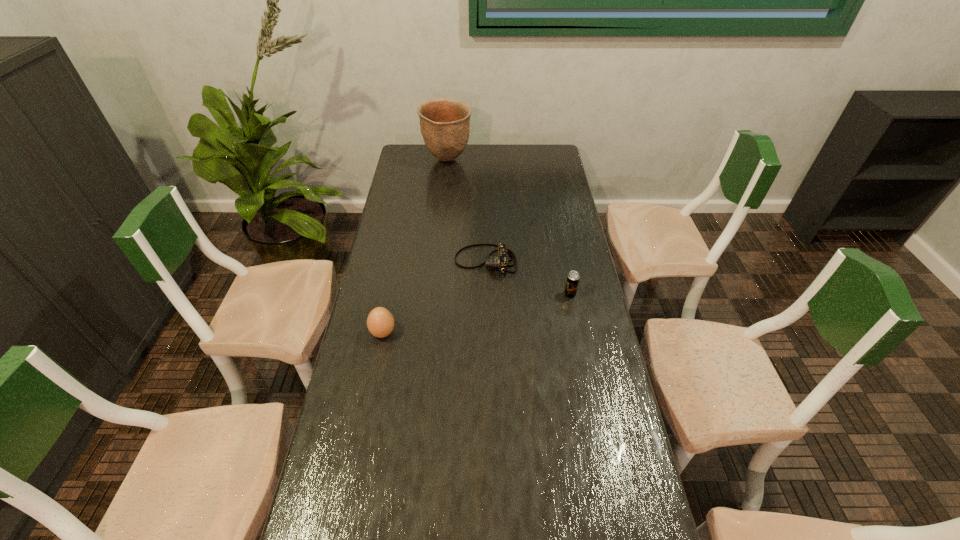
This screenshot has height=540, width=960. Find the location of `vacant space located 0.190m on the front-facing side of the camera`. vacant space located 0.190m on the front-facing side of the camera is located at coordinates (404, 262).

At what (x,y) coordinates should I click in order to perform the action: click on vacant area situated 0.150m on the front-facing side of the camera. Please return your answer as a coordinate pair (x, y). The height and width of the screenshot is (540, 960). Looking at the image, I should click on (415, 262).

Locate an element on the screen. This screenshot has width=960, height=540. free location located 0.270m on the front-facing side of the camera is located at coordinates (383, 262).

What are the coordinates of `object situated at the far edge` in the screenshot? It's located at (445, 123).

Where is `pottery that is positioned at the left edge`? pottery that is positioned at the left edge is located at coordinates (445, 123).

Locate an element on the screen. This screenshot has width=960, height=540. boiled egg at the left edge is located at coordinates (380, 322).

Locate an element on the screen. object present at the right edge is located at coordinates pyautogui.click(x=573, y=277).

This screenshot has width=960, height=540. What are the coordinates of `object at the far left corner` in the screenshot? It's located at (445, 123).

The height and width of the screenshot is (540, 960). Identify the location of vacant area at the far edge of the desktop. (498, 168).

What are the coordinates of `vacant region at the left edge of the desktop` in the screenshot? It's located at (413, 188).